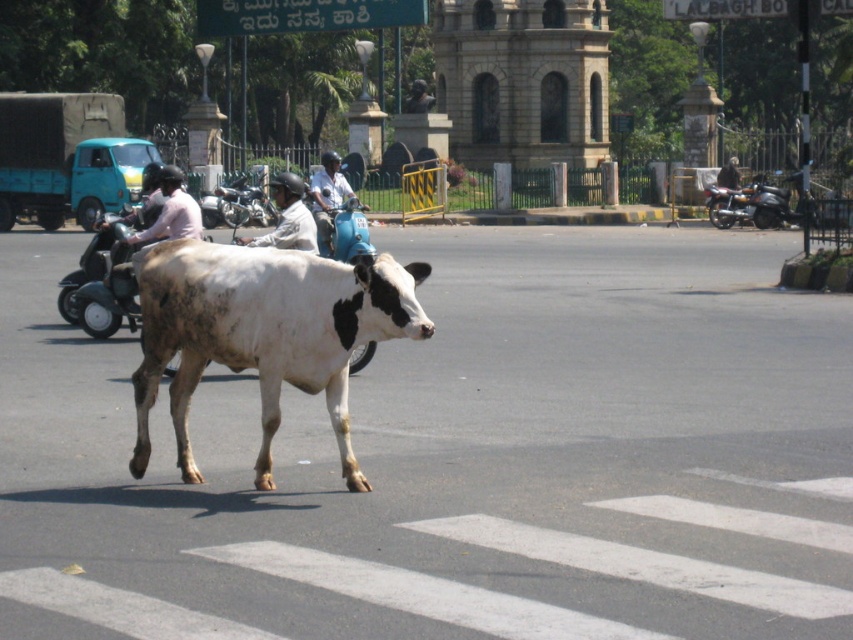
Question: From the image, what is the correct spatial relationship of metallic blue scooter at left in relation to light blue helmet at center?

Choices:
 (A) below
 (B) above

Answer: (A)

Question: Is metallic blue scooter at left thinner than metallic blue motorcycle at center?

Choices:
 (A) no
 (B) yes

Answer: (A)

Question: Which point is farther to the camera?

Choices:
 (A) (383, 320)
 (B) (321, 212)
 (C) (732, 163)

Answer: (C)

Question: Which point is closer to the camera?

Choices:
 (A) metallic blue motorcycle at center
 (B) white matte helmet at center
 (C) light brown leather helmet at center
 (D) white speckled cow at center

Answer: (D)

Question: Which point is closer to the camera taking this photo?

Choices:
 (A) [x=282, y=244]
 (B) [x=218, y=195]
 (C) [x=322, y=387]
 (D) [x=728, y=164]

Answer: (C)

Question: Can you confirm if light blue helmet at center is bigger than light brown leather helmet at center?

Choices:
 (A) yes
 (B) no

Answer: (A)